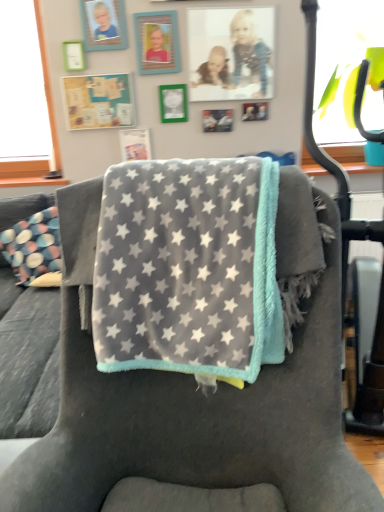
Where is `gray plush blanket at center`? gray plush blanket at center is located at coordinates (189, 412).

Identify the location of wooden picture frame at upper left, which is the 2th picture frame from left to right. The height and width of the screenshot is (512, 384). (104, 24).

The height and width of the screenshot is (512, 384). Describe the element at coordinates (104, 24) in the screenshot. I see `wooden picture frame at upper left, positioned as the 6th picture frame in right-to-left order` at that location.

This screenshot has width=384, height=512. In order to click on gray plush blanket at center in this screenshot , I will do `click(188, 268)`.

Where is `metallic silver photo frame at upper center, which is counted as the seventh picture frame, starting from the left`? This screenshot has width=384, height=512. metallic silver photo frame at upper center, which is counted as the seventh picture frame, starting from the left is located at coordinates (255, 111).

I want to click on green matte picture frame at upper center, the 4th picture frame positioned from the right, so click(173, 103).

I want to click on green matte picture frame at upper left, the 7th picture frame viewed from the right, so click(98, 101).

Locate an element on the screen. This screenshot has width=384, height=512. gray plush blanket at center is located at coordinates (189, 412).

Is matte plastic picture frame at upper center, the 6th picture frame in the left-to-right sequence, aimed at matte black picture frame at center, which ranks as the 5th picture frame in left-to-right order?

No.

From a real-world perspective, is matte plastic picture frame at upper center, the 6th picture frame in the left-to-right sequence, physically located above or below matte black picture frame at center, which ranks as the 5th picture frame in left-to-right order?

Clearly, from a real-world perspective, matte plastic picture frame at upper center, the 6th picture frame in the left-to-right sequence, is above matte black picture frame at center, which ranks as the 5th picture frame in left-to-right order.

In the scene shown: Is matte plastic picture frame at upper center, the 6th picture frame in the left-to-right sequence, to the right of matte black picture frame at center, which ranks as the 5th picture frame in left-to-right order, from the viewer's perspective?

Yes.

From the image's perspective, is matte plastic picture frame at upper center, the 6th picture frame in the left-to-right sequence, below matte black picture frame at center, which ranks as the 5th picture frame in left-to-right order?

No, from the image's perspective, matte plastic picture frame at upper center, the 6th picture frame in the left-to-right sequence, is not beneath matte black picture frame at center, which ranks as the 5th picture frame in left-to-right order.

From a real-world perspective, is matte plastic picture frame at upper center, the second picture frame in the right-to-left sequence, on top of green matte picture frame at upper left, the 7th picture frame viewed from the right?

Yes, from a real-world perspective, matte plastic picture frame at upper center, the second picture frame in the right-to-left sequence, is over green matte picture frame at upper left, the 7th picture frame viewed from the right

Is matte plastic picture frame at upper center, the second picture frame in the right-to-left sequence, facing towards green matte picture frame at upper left, the 7th picture frame viewed from the right?

No.

Between matte plastic picture frame at upper center, the 6th picture frame in the left-to-right sequence, and green matte picture frame at upper left, the 7th picture frame viewed from the right, which one has more height?

matte plastic picture frame at upper center, the 6th picture frame in the left-to-right sequence, is taller.

Can you confirm if matte plastic picture frame at upper center, the 6th picture frame in the left-to-right sequence, is wider than green matte picture frame at upper left, the 7th picture frame viewed from the right?

No.

Based on the photo, from the image's perspective, which is below, matte plastic picture frame at upper center, the 6th picture frame in the left-to-right sequence, or gray plush blanket at center?

gray plush blanket at center.

From a real-world perspective, is matte plastic picture frame at upper center, the 6th picture frame in the left-to-right sequence, over gray plush blanket at center?

Yes.

Is matte plastic picture frame at upper center, the second picture frame in the right-to-left sequence, oriented away from gray plush blanket at center?

That's not correct — matte plastic picture frame at upper center, the second picture frame in the right-to-left sequence, is not looking away from gray plush blanket at center.

Does matte plastic picture frame at upper center, the 6th picture frame in the left-to-right sequence, have a larger size compared to gray plush blanket at center?

Actually, matte plastic picture frame at upper center, the 6th picture frame in the left-to-right sequence, might be smaller than gray plush blanket at center.

Considering the relative positions of gray plush blanket at center and matte plastic picture frame at upper center, the 6th picture frame in the left-to-right sequence, in the image provided, is gray plush blanket at center to the right of matte plastic picture frame at upper center, the 6th picture frame in the left-to-right sequence, from the viewer's perspective?

In fact, gray plush blanket at center is to the left of matte plastic picture frame at upper center, the 6th picture frame in the left-to-right sequence.

From a real-world perspective, which object rests below the other?

From a 3D spatial view, gray plush blanket at center is below.

Does gray plush blanket at center have a larger size compared to matte plastic picture frame at upper center, the 6th picture frame in the left-to-right sequence?

Yes, gray plush blanket at center is bigger than matte plastic picture frame at upper center, the 6th picture frame in the left-to-right sequence.

What's the angular difference between gray plush blanket at center and matte plastic picture frame at upper center, the second picture frame in the right-to-left sequence,'s facing directions?

7.78 degrees separate the facing orientations of gray plush blanket at center and matte plastic picture frame at upper center, the second picture frame in the right-to-left sequence.

From a real-world perspective, between green matte picture frame at upper left, acting as the first picture frame starting from the left, and gray plush blanket at center, who is vertically lower?

gray plush blanket at center is physically lower.

From the picture: From the image's perspective, which is below, green matte picture frame at upper left, acting as the first picture frame starting from the left, or gray plush blanket at center?

gray plush blanket at center is shown below in the image.

Considering the relative sizes of green matte picture frame at upper left, acting as the first picture frame starting from the left, and gray plush blanket at center in the image provided, is green matte picture frame at upper left, acting as the first picture frame starting from the left, taller than gray plush blanket at center?

In fact, green matte picture frame at upper left, acting as the first picture frame starting from the left, may be shorter than gray plush blanket at center.

Is point (215, 231) farther from viewer compared to point (92, 183)?

No, it is in front of (92, 183).

What are the coordinates of `chair located on the left of gray plush blanket at center` in the screenshot? It's located at (189, 412).

What's the angular difference between wooden picture frame at upper left, which is the 2th picture frame from left to right, and metallic silver photo frame at upper center, which is counted as the seventh picture frame, starting from the left,'s facing directions?

The angular difference between wooden picture frame at upper left, which is the 2th picture frame from left to right, and metallic silver photo frame at upper center, which is counted as the seventh picture frame, starting from the left, is 0.3 degrees.

Is wooden picture frame at upper left, which is the 2th picture frame from left to right, directly adjacent to metallic silver photo frame at upper center, the first picture frame from the right?

wooden picture frame at upper left, which is the 2th picture frame from left to right, and metallic silver photo frame at upper center, the first picture frame from the right, are not in contact.

Is wooden picture frame at upper left, which is the 2th picture frame from left to right, shorter than metallic silver photo frame at upper center, which is counted as the seventh picture frame, starting from the left?

In fact, wooden picture frame at upper left, which is the 2th picture frame from left to right, may be taller than metallic silver photo frame at upper center, which is counted as the seventh picture frame, starting from the left.

From the image's perspective, is wooden picture frame at upper left, positioned as the 6th picture frame in right-to-left order, located beneath metallic silver photo frame at upper center, the first picture frame from the right?

No.

Find the location of a particular element. The width and height of the screenshot is (384, 512). the 1st picture frame counting from the right of the matte black picture frame at center, which ranks as the 5th picture frame in left-to-right order is located at coordinates (231, 53).

Where is `the 1st picture frame below the matte plastic picture frame at upper center, the 6th picture frame in the left-to-right sequence (from the image's perspective)`? The image size is (384, 512). the 1st picture frame below the matte plastic picture frame at upper center, the 6th picture frame in the left-to-right sequence (from the image's perspective) is located at coordinates (98, 101).

When comparing their distances from matte plastic picture frame at upper center, the second picture frame in the right-to-left sequence, does gray plush blanket at center or matte black picture frame at center, which ranks as the 5th picture frame in left-to-right order, seem closer?

Based on the image, matte black picture frame at center, which ranks as the 5th picture frame in left-to-right order, appears to be nearer to matte plastic picture frame at upper center, the second picture frame in the right-to-left sequence.

Looking at the image, which one is located closer to green matte picture frame at upper center, arranged as the fourth picture frame when viewed from the left, gray plush blanket at center or teal matte picture frame at upper center, which is the third picture frame in left-to-right order?

Among the two, teal matte picture frame at upper center, which is the third picture frame in left-to-right order, is located nearer to green matte picture frame at upper center, arranged as the fourth picture frame when viewed from the left.

From the image, which object appears to be farther from gray plush blanket at center, metallic silver photo frame at upper center, which is counted as the seventh picture frame, starting from the left, or wooden picture frame at upper left, which is the 2th picture frame from left to right?

Based on the image, wooden picture frame at upper left, which is the 2th picture frame from left to right, appears to be further to gray plush blanket at center.

Estimate the real-world distances between objects in this image. Which object is further from green matte picture frame at upper left, acting as the first picture frame starting from the left, wooden picture frame at upper left, which is the 2th picture frame from left to right, or matte black picture frame at center, placed as the 3th picture frame when sorted from right to left?

The object further to green matte picture frame at upper left, acting as the first picture frame starting from the left, is matte black picture frame at center, placed as the 3th picture frame when sorted from right to left.

Estimate the real-world distances between objects in this image. Which object is further from matte plastic picture frame at upper center, the second picture frame in the right-to-left sequence, green matte picture frame at upper left, the 7th picture frame viewed from the right, or gray plush blanket at center?

gray plush blanket at center is further to matte plastic picture frame at upper center, the second picture frame in the right-to-left sequence.

Which object lies nearer to the anchor point green matte picture frame at upper center, arranged as the fourth picture frame when viewed from the left, gray plush blanket at center or metallic silver photo frame at upper center, which is counted as the seventh picture frame, starting from the left?

Based on the image, metallic silver photo frame at upper center, which is counted as the seventh picture frame, starting from the left, appears to be nearer to green matte picture frame at upper center, arranged as the fourth picture frame when viewed from the left.

When comparing their distances from matte black picture frame at center, placed as the 3th picture frame when sorted from right to left, does green matte picture frame at upper left, acting as the first picture frame starting from the left, or matte plastic picture frame at upper center, the 6th picture frame in the left-to-right sequence, seem closer?

matte plastic picture frame at upper center, the 6th picture frame in the left-to-right sequence, lies closer to matte black picture frame at center, placed as the 3th picture frame when sorted from right to left, than the other object.

From the image, which object appears to be farther from metallic silver photo frame at upper center, which is counted as the seventh picture frame, starting from the left, gray plush blanket at center or wooden picture frame at upper left, positioned as the 6th picture frame in right-to-left order?

Among the two, gray plush blanket at center is located further to metallic silver photo frame at upper center, which is counted as the seventh picture frame, starting from the left.

The image size is (384, 512). I want to click on beach towel positioned between gray plush blanket at center and wooden picture frame at upper left, which is the 2th picture frame from left to right, from near to far, so click(x=188, y=268).

Where is `picture frame located between gray plush blanket at center and teal matte picture frame at upper center, which is the third picture frame in left-to-right order, in the depth direction`? picture frame located between gray plush blanket at center and teal matte picture frame at upper center, which is the third picture frame in left-to-right order, in the depth direction is located at coordinates (104, 24).

Identify the location of beach towel between gray plush blanket at center and matte plastic picture frame at upper center, the second picture frame in the right-to-left sequence, in the front-back direction. This screenshot has width=384, height=512. point(188,268).

What are the coordinates of `beach towel between gray plush blanket at center and metallic silver photo frame at upper center, the first picture frame from the right, in the front-back direction` in the screenshot? It's located at (188, 268).